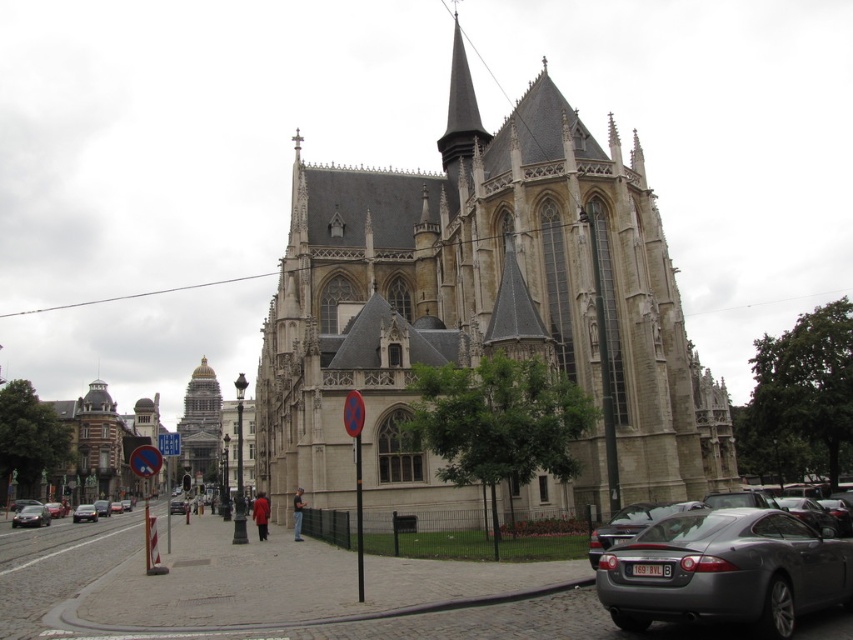
Is stone gothic church at center shorter than silver metallic sedan at lower left?

Incorrect, stone gothic church at center's height does not fall short of silver metallic sedan at lower left's.

Who is positioned more to the left, stone gothic church at center or silver metallic sedan at lower left?

Positioned to the left is silver metallic sedan at lower left.

Between point (563, 228) and point (103, 515), which one is positioned behind?

Point (103, 515)

Image resolution: width=853 pixels, height=640 pixels. What are the coordinates of `stone gothic church at center` in the screenshot? It's located at (479, 305).

Can you confirm if stone gothic church at center is positioned above metallic gray car at lower right?

Indeed, stone gothic church at center is positioned over metallic gray car at lower right.

Is stone gothic church at center wider than metallic gray car at lower right?

Indeed, stone gothic church at center has a greater width compared to metallic gray car at lower right.

Is point (283, 422) positioned after point (712, 518)?

Yes, it is.

Image resolution: width=853 pixels, height=640 pixels. I want to click on stone gothic church at center, so click(x=479, y=305).

Is stone gothic church at center thinner than brown stone building at left?

In fact, stone gothic church at center might be wider than brown stone building at left.

Who is shorter, stone gothic church at center or brown stone building at left?

brown stone building at left

Which is in front, point (583, 205) or point (77, 397)?

Point (583, 205) is more forward.

I want to click on stone gothic church at center, so click(x=479, y=305).